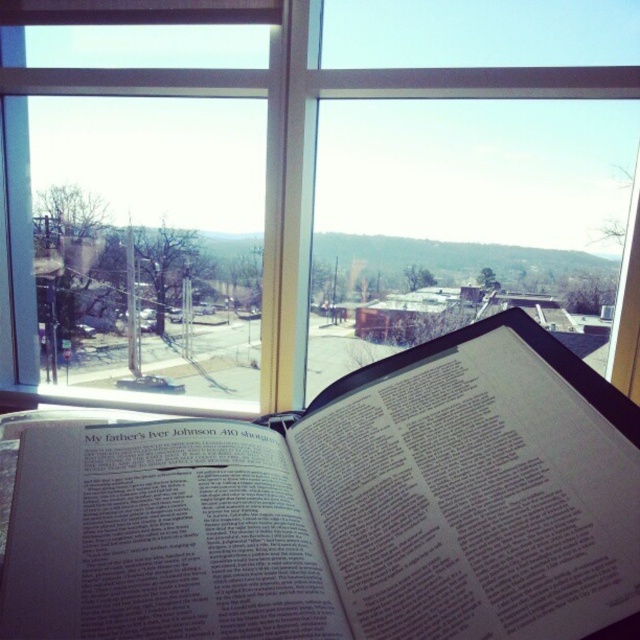
Which of these two, white paper book at center or transparent glass window at center, stands taller?

With more height is transparent glass window at center.

Does white paper book at center have a lesser height compared to transparent glass window at center?

Correct, white paper book at center is not as tall as transparent glass window at center.

Between point (580, 480) and point (602, 72), which one is positioned in front?

Positioned in front is point (580, 480).

This screenshot has height=640, width=640. Find the location of `white paper book at center`. white paper book at center is located at coordinates (346, 509).